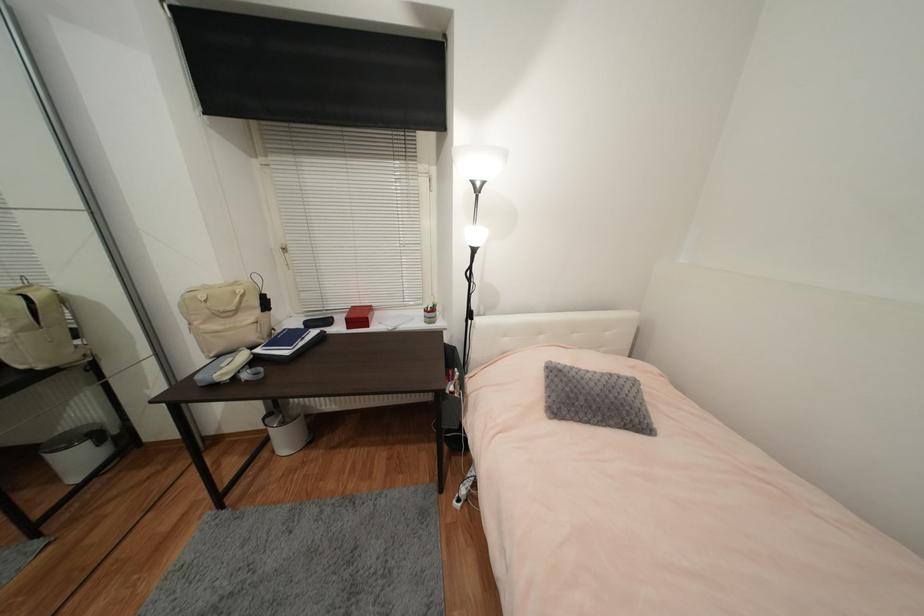
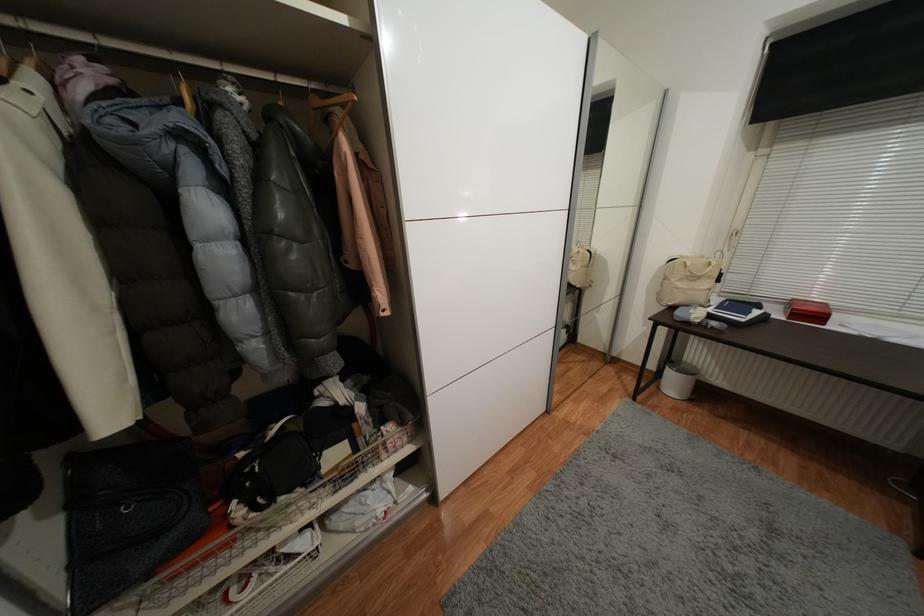
Locate, in the second image, the point that corresponds to point 240,285 in the first image.

(707, 257)